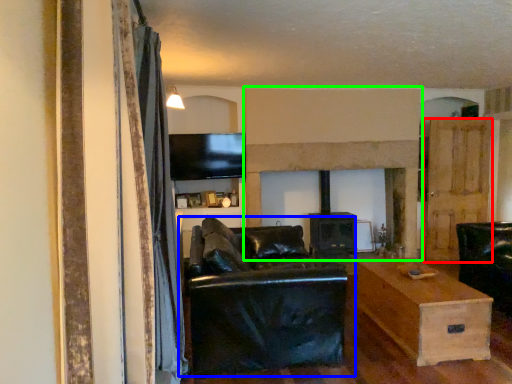
Question: Which object is the farthest from door (highlighted by a red box)? Choose among these: studio couch (highlighted by a blue box) or fireplace (highlighted by a green box).

Choices:
 (A) studio couch
 (B) fireplace

Answer: (A)